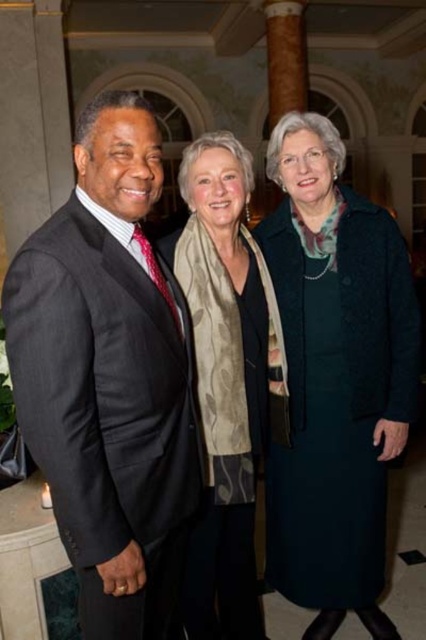
Based on the scene description, which object is bigger between the matte black suit at left and the dark green wool coat at center?

The matte black suit at left is larger in size compared to the dark green wool coat at center.

You are a photographer setting up for a group photo. You notice two items on the person in the center of the image, the dark green wool coat at center and the beige floral scarf at center. Which item is taller?

The dark green wool coat at center is taller than the beige floral scarf at center according to the description.

You are a photographer setting up for a group photo. You notice the matte black suit at left and the beige floral scarf at center. Which object is positioned lower in the frame?

The matte black suit at left is positioned lower in the frame than the beige floral scarf at center.